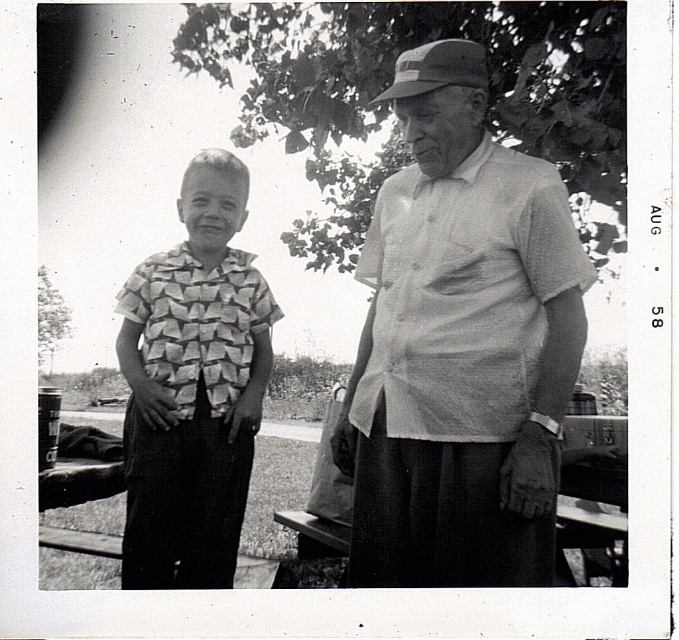
Question: Which point is closer to the camera?

Choices:
 (A) patterned fabric shirt at center
 (B) light gray textured shirt at center

Answer: (B)

Question: From the image, what is the correct spatial relationship of light gray textured shirt at center in relation to patterned fabric shirt at center?

Choices:
 (A) above
 (B) below

Answer: (A)

Question: Which is nearer to the green leafy tree at upper center?

Choices:
 (A) smooth bark tree at left
 (B) patterned fabric shirt at center

Answer: (B)

Question: Which point appears closest to the camera in this image?

Choices:
 (A) (316, 60)
 (B) (521, 232)
 (C) (130, 512)
 (D) (50, 321)

Answer: (B)

Question: Does green leafy tree at upper center have a smaller size compared to patterned fabric shirt at center?

Choices:
 (A) no
 (B) yes

Answer: (A)

Question: Does patterned fabric shirt at center appear on the left side of smooth bark tree at left?

Choices:
 (A) yes
 (B) no

Answer: (B)